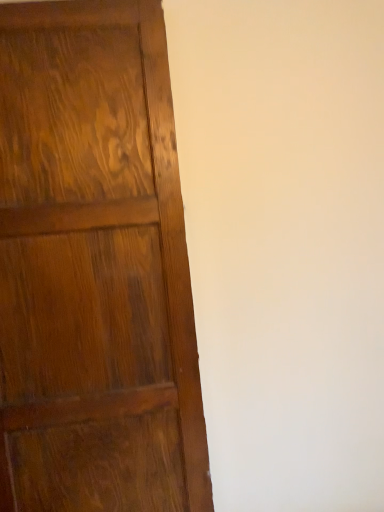
Describe the element at coordinates (94, 268) in the screenshot. I see `shiny brown wood door at upper left` at that location.

Locate an element on the screen. This screenshot has width=384, height=512. shiny brown wood door at upper left is located at coordinates (94, 268).

I want to click on shiny brown wood door at upper left, so click(x=94, y=268).